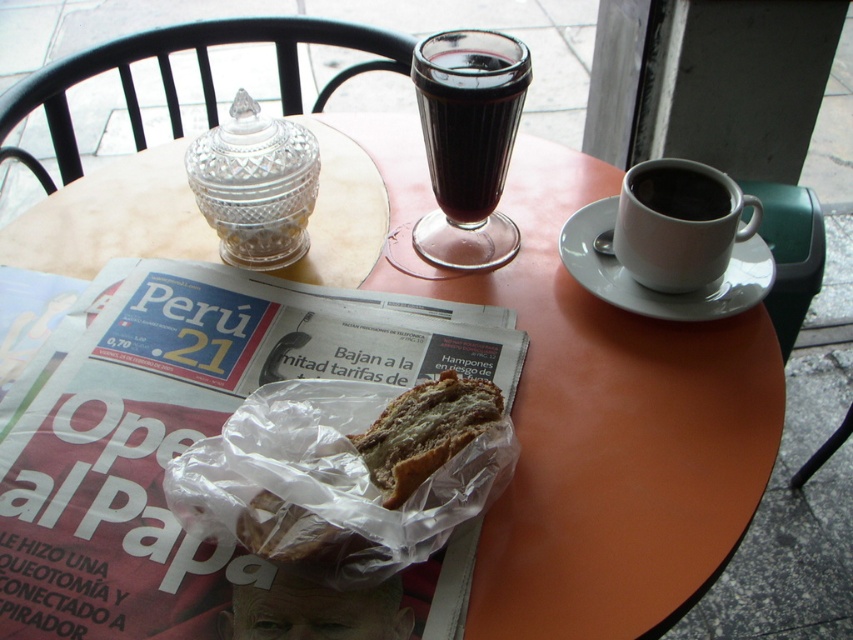
Can you confirm if dark glassy beverage at upper center is positioned to the right of brown crusty bread at center?

Indeed, dark glassy beverage at upper center is positioned on the right side of brown crusty bread at center.

Between point (424, 136) and point (492, 410), which one is positioned behind?

Point (424, 136)

Locate an element on the screen. Image resolution: width=853 pixels, height=640 pixels. dark glassy beverage at upper center is located at coordinates (468, 141).

Does brown crusty bread at center appear under white ceramic saucer at upper right?

Yes, brown crusty bread at center is below white ceramic saucer at upper right.

Is point (437, 461) closer to viewer compared to point (631, 291)?

Yes.

Consider the image. Who is more forward, [418,474] or [585,243]?

Point [418,474] is in front.

Locate an element on the screen. brown crusty bread at center is located at coordinates (425, 432).

Measure the distance between dark glassy beverage at upper center and black matte cup at upper right.

dark glassy beverage at upper center is 4.98 inches from black matte cup at upper right.

Does dark glassy beverage at upper center appear under black matte cup at upper right?

Actually, dark glassy beverage at upper center is above black matte cup at upper right.

Who is more forward, (463, 173) or (659, 196)?

Positioned in front is point (463, 173).

Find the location of a particular element. dark glassy beverage at upper center is located at coordinates (468, 141).